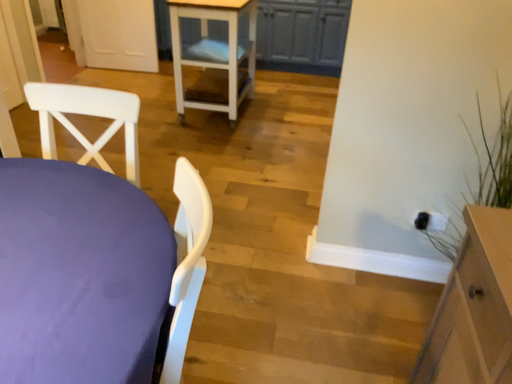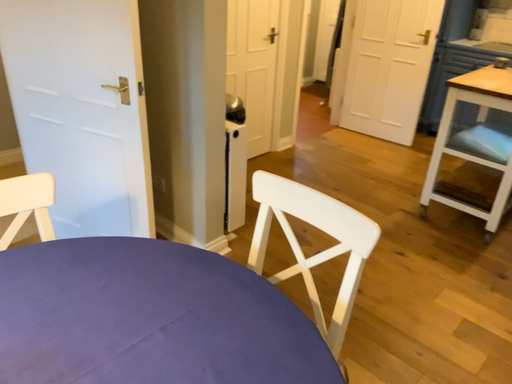
Question: How did the camera likely rotate when shooting the video?

Choices:
 (A) rotated left
 (B) rotated right

Answer: (A)